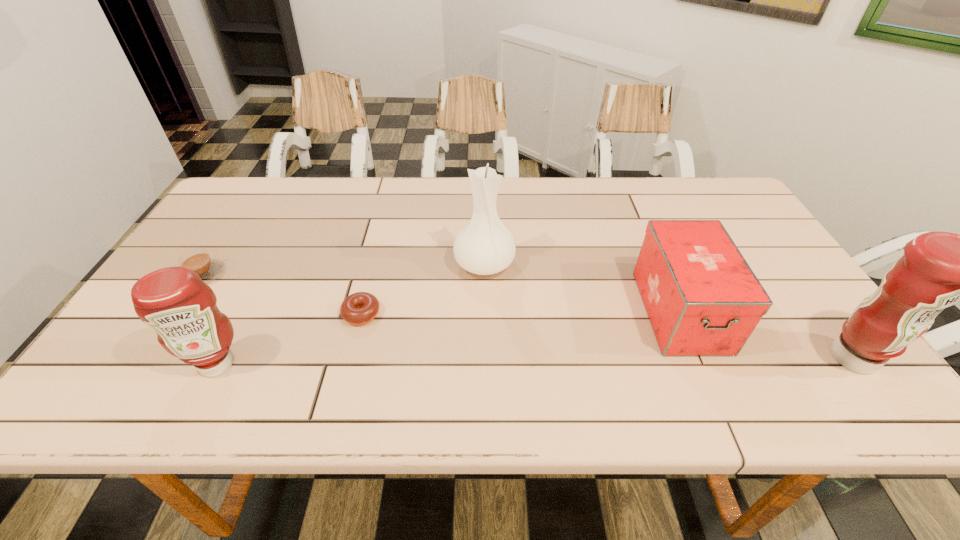
Where is `free space between the fifth object from left to right and the left condiment`? This screenshot has width=960, height=540. free space between the fifth object from left to right and the left condiment is located at coordinates (448, 338).

Image resolution: width=960 pixels, height=540 pixels. I want to click on object that is the fourth closest to the fourth object from right to left, so [702, 298].

Locate which object ranks fourth in proximity to the vase. Please provide its 2D coordinates. Your answer should be formatted as a tuple, i.e. [(x, y)], where the tuple contains the x and y coordinates of a point satisfying the conditions above.

[(198, 260)]

What are the coordinates of `free point that satisfies the following two spatial constraints: 1. on the back side of the vase; 2. on the right side of the doughnut` in the screenshot? It's located at [374, 264].